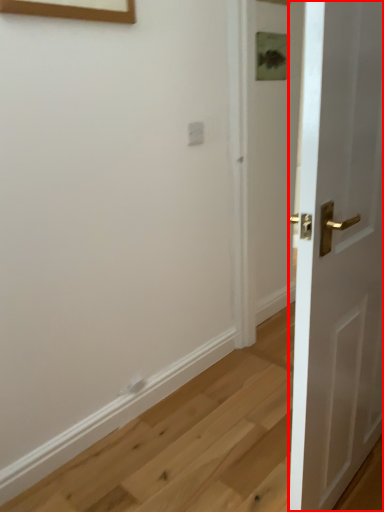
Question: In this image, where is door (annotated by the red box) located relative to electric outlet?

Choices:
 (A) right
 (B) left

Answer: (A)